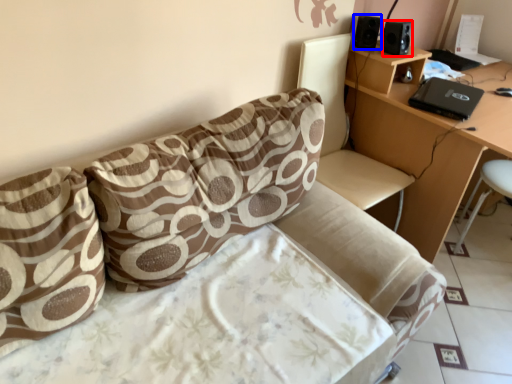
Question: Which point is further to the camera, speaker (highlighted by a red box) or speaker (highlighted by a blue box)?

Choices:
 (A) speaker
 (B) speaker

Answer: (B)